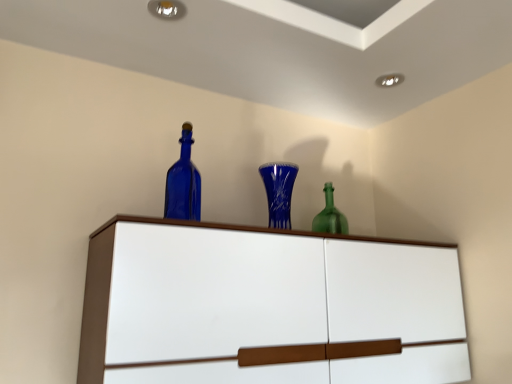
The width and height of the screenshot is (512, 384). Find the location of `white glossy cupboard at upper center`. white glossy cupboard at upper center is located at coordinates (265, 303).

Considering the sizes of white glossy cupboard at upper center and blue glass vase at center in the image, is white glossy cupboard at upper center bigger or smaller than blue glass vase at center?

Considering their sizes, white glossy cupboard at upper center takes up more space than blue glass vase at center.

Considering the sizes of white glossy cupboard at upper center and blue glass vase at center in the image, is white glossy cupboard at upper center taller or shorter than blue glass vase at center?

In the image, white glossy cupboard at upper center appears to be taller than blue glass vase at center.

Is white glossy cupboard at upper center touching blue glass vase at center?

No, white glossy cupboard at upper center is not with blue glass vase at center.

At what (x,y) coordinates should I click in order to perform the action: click on glass vase located above the white glossy cupboard at upper center (from the image's perspective). Please return your answer as a coordinate pair (x, y). Looking at the image, I should click on (279, 192).

From the image's perspective, between blue glass vase at center and blue glass bottle at upper center, who is located below?

blue glass vase at center is shown below in the image.

Is blue glass vase at center positioned far away from blue glass bottle at upper center?

No, blue glass vase at center is not far from blue glass bottle at upper center.

How different are the orientations of blue glass vase at center and blue glass bottle at upper center in degrees?

0.189 degrees separate the facing orientations of blue glass vase at center and blue glass bottle at upper center.

In the image, is blue glass vase at center positioned in front of or behind blue glass bottle at upper center?

Visually, blue glass vase at center is located behind blue glass bottle at upper center.

Which of these two, blue glass bottle at upper center or blue glass vase at center, stands shorter?

Standing shorter between the two is blue glass vase at center.

Is blue glass bottle at upper center to the left or to the right of blue glass vase at center in the image?

From the image, it's evident that blue glass bottle at upper center is to the left of blue glass vase at center.

What are the coordinates of `bottle above the blue glass vase at center (from a real-world perspective)` in the screenshot? It's located at click(x=183, y=183).

Which is nearer, [180,187] or [280,176]?

Clearly, point [180,187] is more distant from the camera than point [280,176].

This screenshot has height=384, width=512. Find the location of `bottle above the white glossy cupboard at upper center (from a real-world perspective)`. bottle above the white glossy cupboard at upper center (from a real-world perspective) is located at coordinates (183, 183).

Is the position of white glossy cupboard at upper center less distant than that of blue glass bottle at upper center?

Yes, white glossy cupboard at upper center is closer to the camera.

Is white glossy cupboard at upper center with blue glass bottle at upper center?

No, white glossy cupboard at upper center is not beside blue glass bottle at upper center.

Are blue glass vase at center and white glossy cupboard at upper center making contact?

No, blue glass vase at center is not making contact with white glossy cupboard at upper center.

Is blue glass vase at center at the left side of white glossy cupboard at upper center?

Yes, blue glass vase at center is to the left of white glossy cupboard at upper center.

Can white glossy cupboard at upper center be found inside blue glass vase at center?

No, white glossy cupboard at upper center is not inside blue glass vase at center.

In terms of height, does blue glass vase at center look taller or shorter compared to white glossy cupboard at upper center?

In the image, blue glass vase at center appears to be shorter than white glossy cupboard at upper center.

Which is in front, point (181, 207) or point (207, 234)?

The point (207, 234) is closer to the camera.

From a real-world perspective, does blue glass bottle at upper center stand above white glossy cupboard at upper center?

Yes, from a real-world perspective, blue glass bottle at upper center is over white glossy cupboard at upper center

The image size is (512, 384). Identify the location of cupboard located underneath the blue glass vase at center (from a real-world perspective). (265, 303).

In order to click on bottle above the blue glass vase at center (from a real-world perspective) in this screenshot , I will do [x=183, y=183].

Considering their positions, is blue glass vase at center positioned closer to blue glass bottle at upper center than white glossy cupboard at upper center?

blue glass vase at center is closer to blue glass bottle at upper center.

Which object lies nearer to the anchor point blue glass vase at center, blue glass bottle at upper center or white glossy cupboard at upper center?

Based on the image, blue glass bottle at upper center appears to be nearer to blue glass vase at center.

When comparing their distances from white glossy cupboard at upper center, does blue glass vase at center or blue glass bottle at upper center seem further?

The object further to white glossy cupboard at upper center is blue glass bottle at upper center.

Considering their positions, is white glossy cupboard at upper center positioned further to blue glass bottle at upper center than blue glass vase at center?

white glossy cupboard at upper center.

When comparing their distances from blue glass vase at center, does white glossy cupboard at upper center or blue glass bottle at upper center seem closer?

blue glass bottle at upper center is positioned closer to the anchor blue glass vase at center.

Which object lies nearer to the anchor point white glossy cupboard at upper center, blue glass bottle at upper center or blue glass vase at center?

blue glass vase at center is closer to white glossy cupboard at upper center.

I want to click on bottle positioned between white glossy cupboard at upper center and blue glass vase at center from near to far, so click(183, 183).